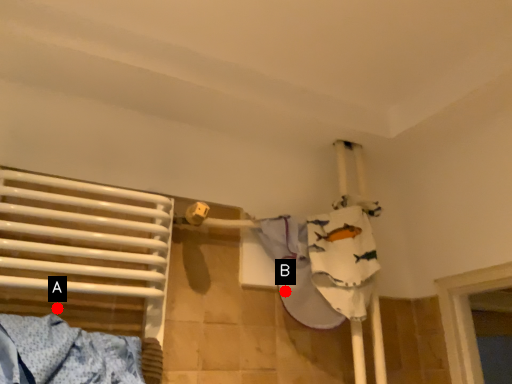
Question: Two points are circled on the image, labeled by A and B beside each circle. Which point is closer to the camera?

Choices:
 (A) A is closer
 (B) B is closer

Answer: (A)